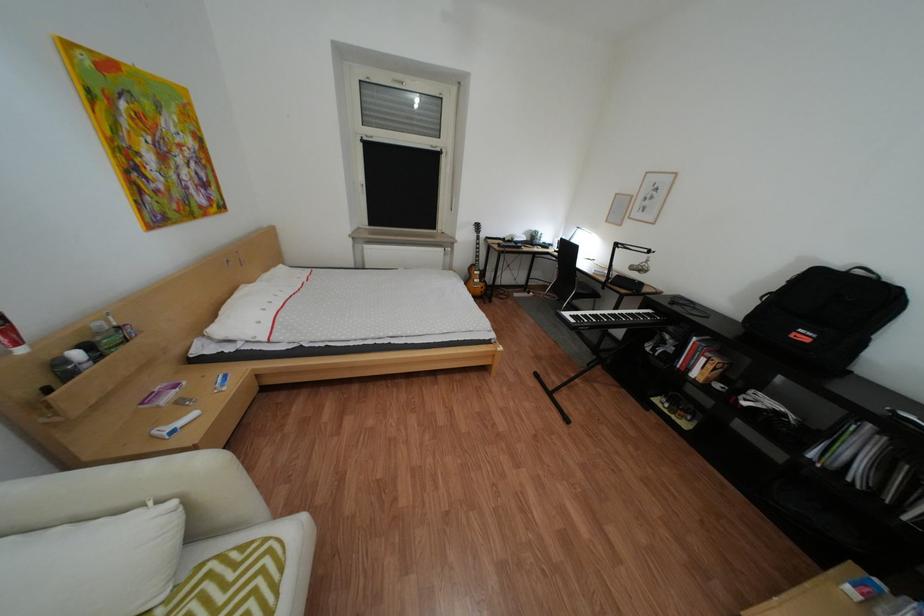
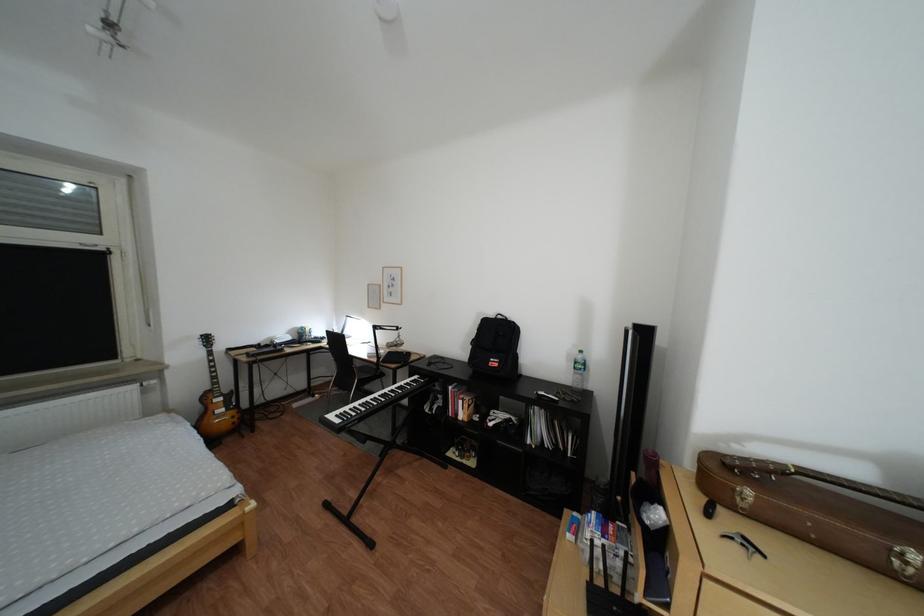
Locate, in the second image, the point that corresponds to (x=596, y=283) in the first image.

(379, 368)